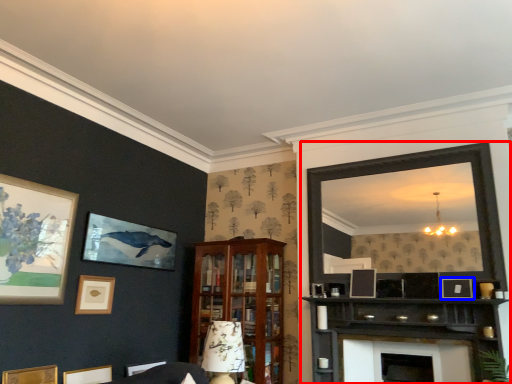
Question: Among these objects, which one is farthest to the camera, entertainment center (highlighted by a red box) or picture frame (highlighted by a blue box)?

Choices:
 (A) entertainment center
 (B) picture frame

Answer: (B)